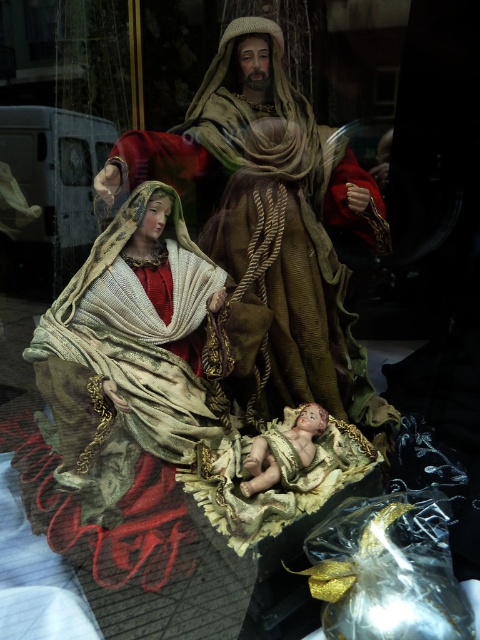
Question: Does velvet brown robe at center lie in front of smooth porcelain baby at center?

Choices:
 (A) no
 (B) yes

Answer: (A)

Question: Does velvet brown robe at center have a smaller size compared to smooth porcelain baby at center?

Choices:
 (A) no
 (B) yes

Answer: (A)

Question: Can you confirm if velvet brown robe at center is positioned above smooth porcelain baby at center?

Choices:
 (A) no
 (B) yes

Answer: (B)

Question: Which point is farther to the camera?

Choices:
 (A) smooth porcelain baby at center
 (B) velvet brown robe at center

Answer: (B)

Question: Which object is closer to the camera taking this photo?

Choices:
 (A) smooth porcelain baby at center
 (B) velvet brown robe at center

Answer: (A)